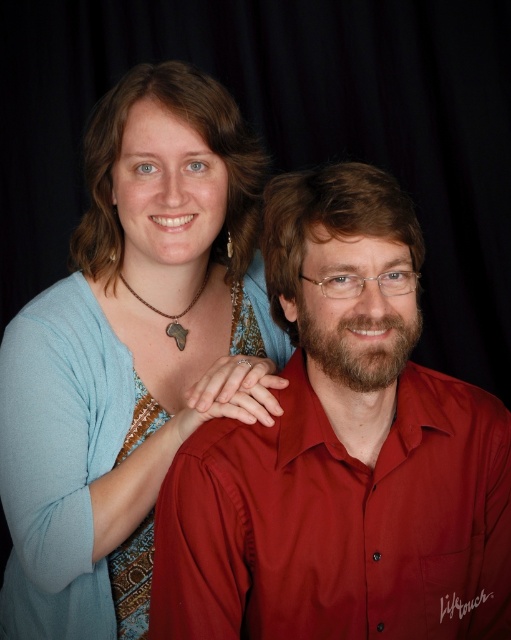
Can you confirm if matte red shirt at center is shorter than matte blue sweater at upper left?

Yes.

This screenshot has width=511, height=640. What do you see at coordinates (341, 452) in the screenshot?
I see `matte red shirt at center` at bounding box center [341, 452].

Where is `matte red shirt at center`? matte red shirt at center is located at coordinates (341, 452).